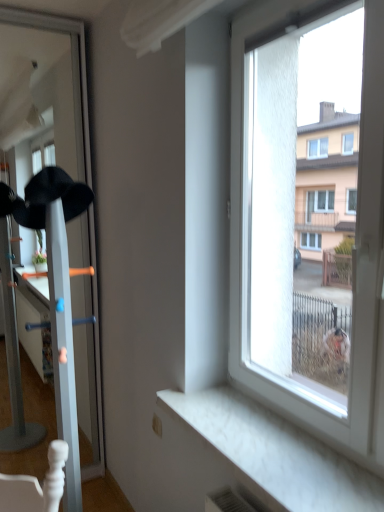
Question: Considering the relative sizes of black matte baseball hat at left and white glossy coat rack at left in the image provided, is black matte baseball hat at left smaller than white glossy coat rack at left?

Choices:
 (A) yes
 (B) no

Answer: (A)

Question: Is the position of black matte baseball hat at left less distant than that of white glossy coat rack at left?

Choices:
 (A) yes
 (B) no

Answer: (B)

Question: Is black matte baseball hat at left shorter than white glossy coat rack at left?

Choices:
 (A) yes
 (B) no

Answer: (A)

Question: From the image's perspective, is black matte baseball hat at left under white glossy coat rack at left?

Choices:
 (A) no
 (B) yes

Answer: (A)

Question: Is white glossy coat rack at left located within black matte baseball hat at left?

Choices:
 (A) yes
 (B) no

Answer: (B)

Question: Can you confirm if black matte baseball hat at left is positioned to the right of white glossy coat rack at left?

Choices:
 (A) no
 (B) yes

Answer: (A)

Question: From a real-world perspective, is white marble window sill at lower right physically above white glossy coat rack at left?

Choices:
 (A) yes
 (B) no

Answer: (B)

Question: Is white marble window sill at lower right placed right next to white glossy coat rack at left?

Choices:
 (A) no
 (B) yes

Answer: (A)

Question: Is white marble window sill at lower right thinner than white glossy coat rack at left?

Choices:
 (A) yes
 (B) no

Answer: (A)

Question: Is white marble window sill at lower right bigger than white glossy coat rack at left?

Choices:
 (A) yes
 (B) no

Answer: (B)

Question: From a real-world perspective, is white marble window sill at lower right below white glossy coat rack at left?

Choices:
 (A) no
 (B) yes

Answer: (B)

Question: Could white glossy coat rack at left be considered to be inside white marble window sill at lower right?

Choices:
 (A) no
 (B) yes

Answer: (A)

Question: From the image's perspective, is white glossy coat rack at left on top of black matte baseball hat at left?

Choices:
 (A) yes
 (B) no

Answer: (B)